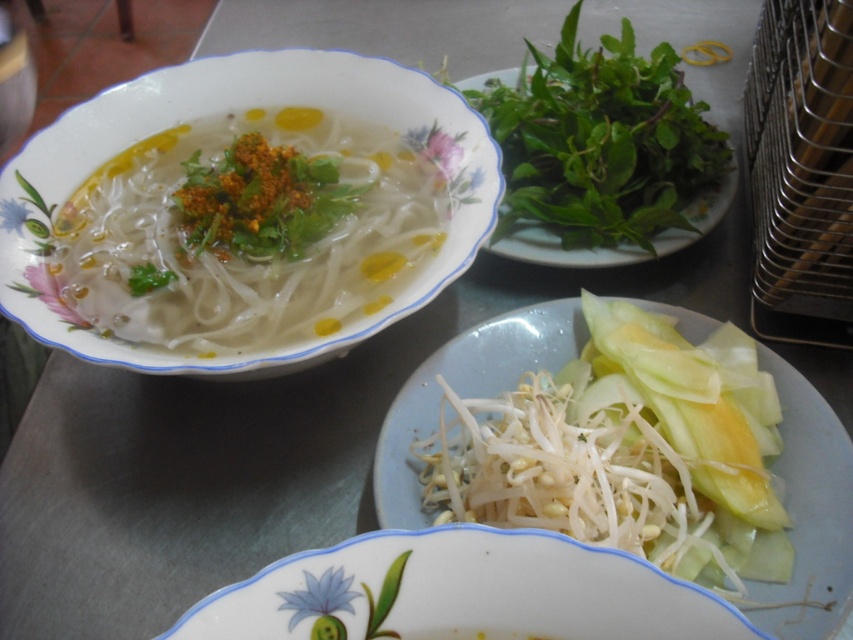
Which of these two, white translucent bean sprouts at lower center or white translucent noodles at lower center, stands shorter?

white translucent noodles at lower center is shorter.

This screenshot has height=640, width=853. What are the coordinates of `white translucent bean sprouts at lower center` in the screenshot? It's located at (628, 451).

Is translucent noodles at center further to camera compared to white translucent noodles at lower center?

Yes, translucent noodles at center is behind white translucent noodles at lower center.

Describe the element at coordinates (247, 230) in the screenshot. I see `translucent noodles at center` at that location.

Identify the location of translucent noodles at center. The width and height of the screenshot is (853, 640). (247, 230).

Is point (326, 230) less distant than point (544, 154)?

Yes, it is in front of point (544, 154).

Find the location of a particular element. This screenshot has width=853, height=640. translucent noodles at center is located at coordinates (247, 230).

At what (x,y) coordinates should I click in order to perform the action: click on translucent noodles at center. Please return your answer as a coordinate pair (x, y). This screenshot has height=640, width=853. Looking at the image, I should click on (247, 230).